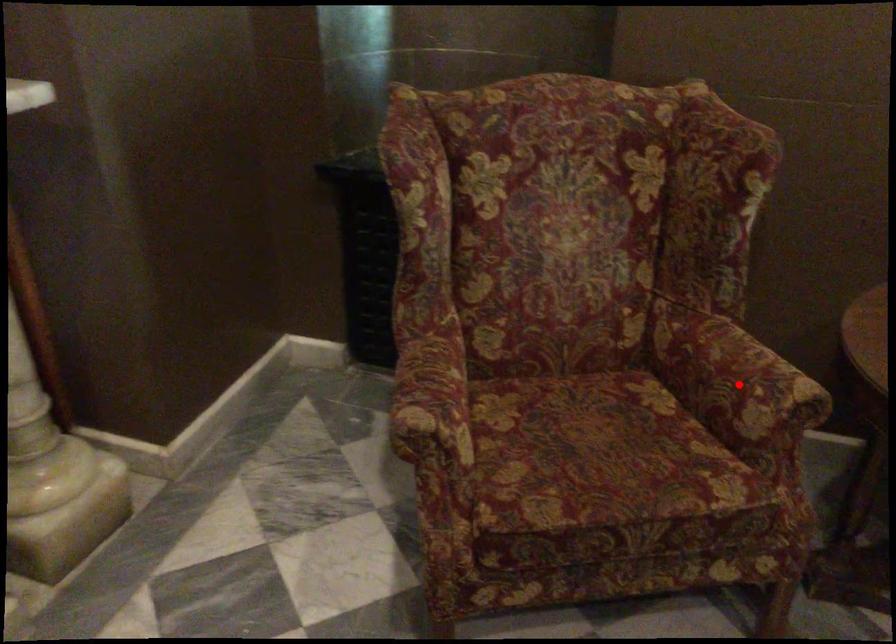
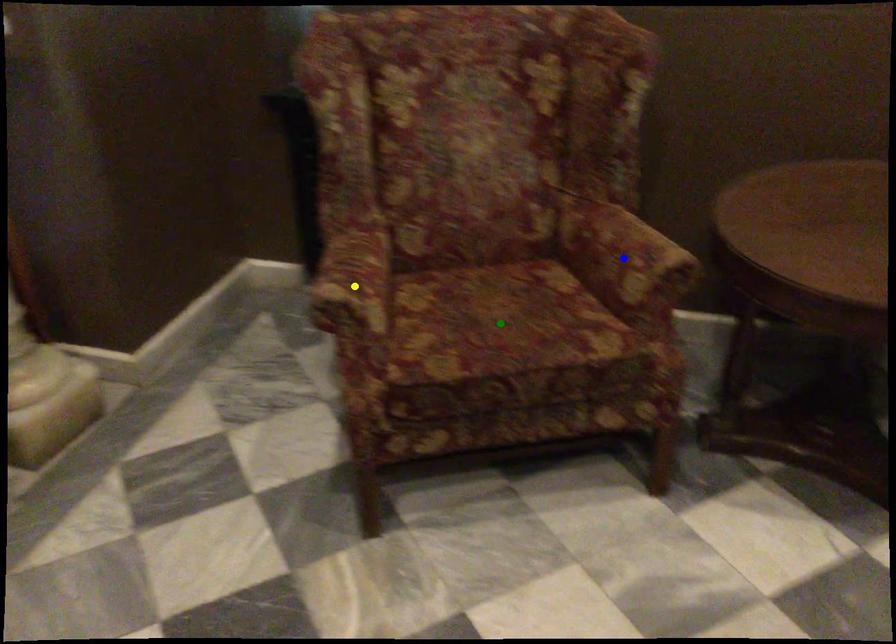
Question: I am providing you with two images of the same scene from different viewpoints. A red point is marked on the first image. You are given multiple points on the second image. Which point in image 2 represents the same 3d spot as the red point in image 1?

Choices:
 (A) green point
 (B) yellow point
 (C) blue point

Answer: (C)